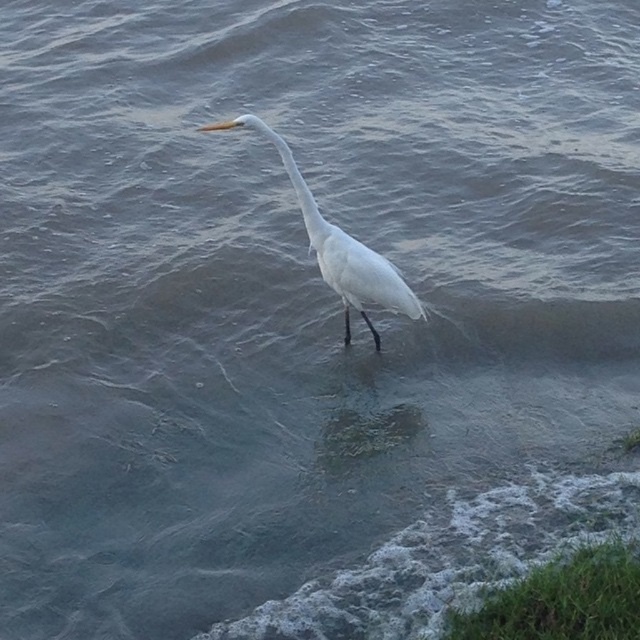
Question: Is white matte bird at center positioned behind white smooth neck at center?

Choices:
 (A) no
 (B) yes

Answer: (B)

Question: Which point is closer to the camera taking this photo?

Choices:
 (A) (289, 148)
 (B) (378, 288)

Answer: (A)

Question: Can you confirm if white matte bird at center is smaller than white smooth neck at center?

Choices:
 (A) yes
 (B) no

Answer: (B)

Question: Does white matte bird at center have a lesser width compared to white smooth neck at center?

Choices:
 (A) yes
 (B) no

Answer: (B)

Question: Which point is closer to the camera?

Choices:
 (A) (392, 275)
 (B) (288, 172)

Answer: (A)

Question: Which object is farther from the camera taking this photo?

Choices:
 (A) white matte bird at center
 (B) white smooth neck at center

Answer: (A)